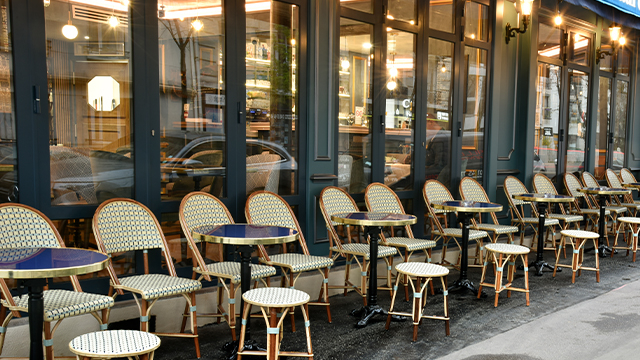
Image resolution: width=640 pixels, height=360 pixels. Find the location of `stools`. stools is located at coordinates (635, 227), (582, 237), (513, 253), (417, 268), (276, 301), (134, 335).